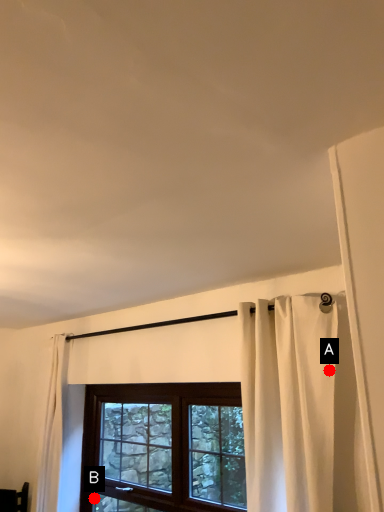
Question: Two points are circled on the image, labeled by A and B beside each circle. Which point is further to the camera?

Choices:
 (A) A is further
 (B) B is further

Answer: (B)